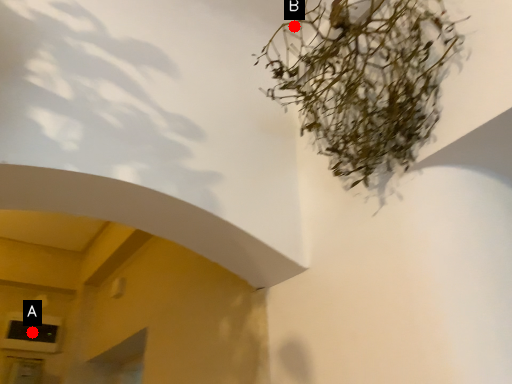
Question: Two points are circled on the image, labeled by A and B beside each circle. Which point appears farthest from the camera in this image?

Choices:
 (A) A is further
 (B) B is further

Answer: (A)